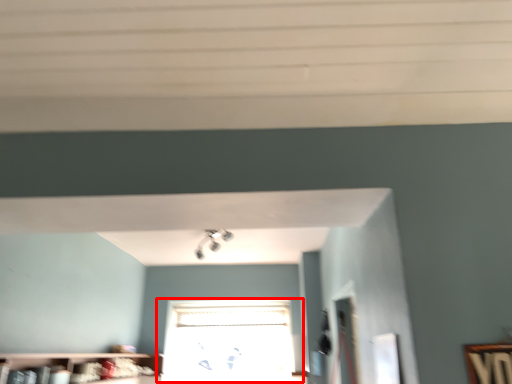
Question: From the image's perspective, what is the correct spatial relationship of window (annotated by the red box) in relation to shelf?

Choices:
 (A) below
 (B) above

Answer: (A)